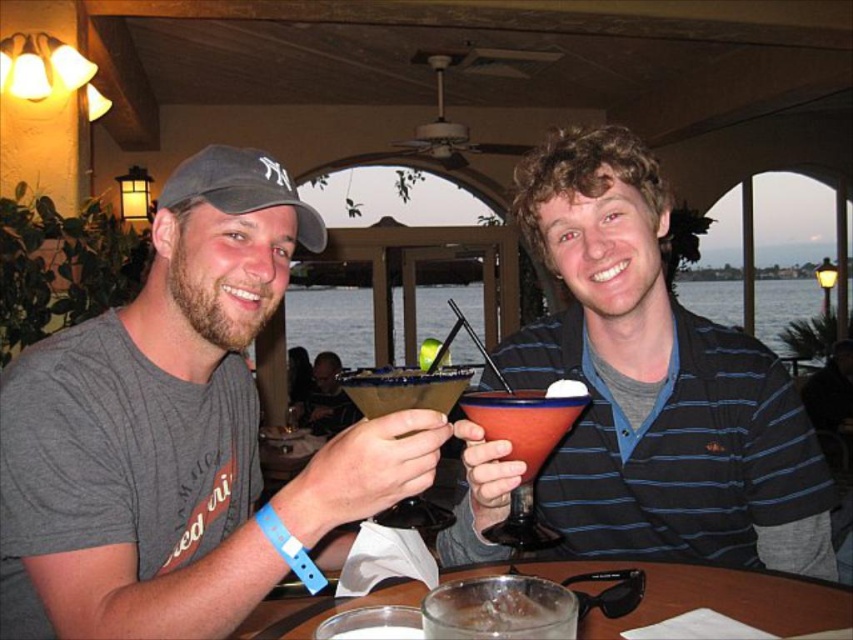
Who is positioned more to the left, matte gray t-shirt at center or matte gray baseball cap at left?

Positioned to the left is matte gray baseball cap at left.

At what (x,y) coordinates should I click in order to perform the action: click on matte gray t-shirt at center. Please return your answer as a coordinate pair (x, y). Image resolution: width=853 pixels, height=640 pixels. Looking at the image, I should click on (178, 433).

Where is `matte gray t-shirt at center`? This screenshot has height=640, width=853. matte gray t-shirt at center is located at coordinates (178, 433).

Can you confirm if matte gray t-shirt at center is smaller than clear glass ice at center?

No.

Is point (106, 352) more distant than point (480, 611)?

That is True.

What do you see at coordinates (178, 433) in the screenshot? Image resolution: width=853 pixels, height=640 pixels. I see `matte gray t-shirt at center` at bounding box center [178, 433].

You are a GUI agent. You are given a task and a screenshot of the screen. Output one action in this format:
    pyautogui.click(x=<x>, y=<y>)
    Task: Click on the matte gray t-shirt at center
    
    Given the screenshot: What is the action you would take?
    pyautogui.click(x=178, y=433)

Which is more to the left, matte gray t-shirt at center or matte red glass at right?

From the viewer's perspective, matte gray t-shirt at center appears more on the left side.

Between matte gray t-shirt at center and matte red glass at right, which one appears on the right side from the viewer's perspective?

Positioned to the right is matte red glass at right.

Measure the distance between point (x=222, y=435) and camera.

Point (x=222, y=435) is 3.54 feet away from camera.

The image size is (853, 640). In order to click on matte gray t-shirt at center in this screenshot , I will do `click(178, 433)`.